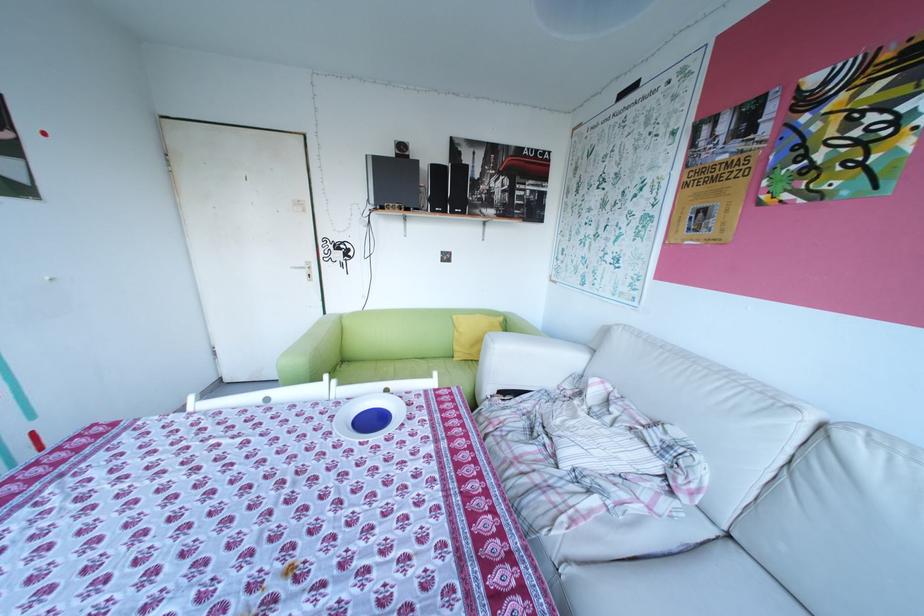
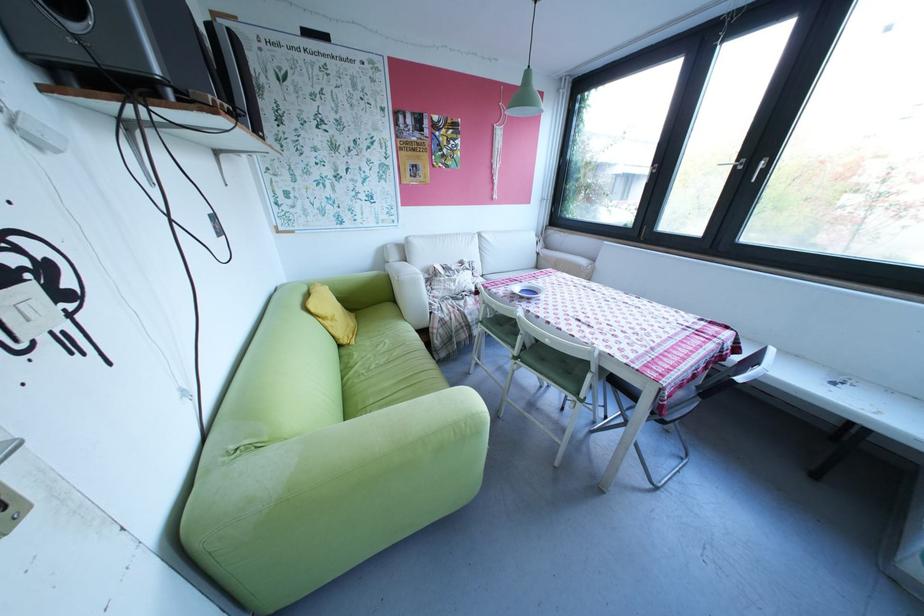
Locate, in the second image, the point that corresponds to the point at 833,155 in the first image.

(457, 151)